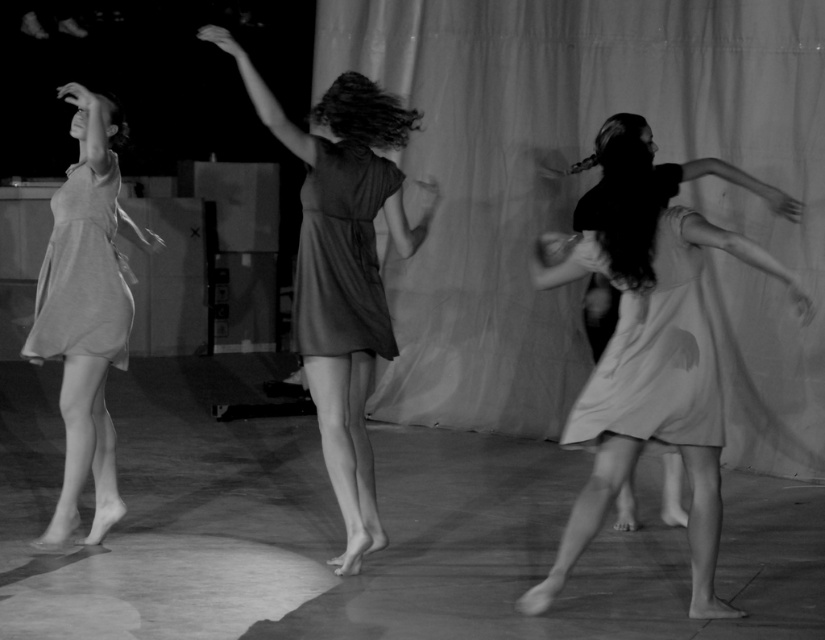
Question: Where is matte white dress at right located in relation to satin dress at center in the image?

Choices:
 (A) above
 (B) below

Answer: (B)

Question: Which point appears farthest from the camera in this image?

Choices:
 (A) (349, 244)
 (B) (310, 314)
 (C) (72, 289)
 (D) (92, 212)

Answer: (D)

Question: Can you confirm if matte gray dress at left is positioned below light gray cotton dress at left?

Choices:
 (A) no
 (B) yes

Answer: (B)

Question: Which point is farther to the camera?

Choices:
 (A) (668, 234)
 (B) (78, 225)
 (C) (262, 93)

Answer: (B)

Question: Is matte dark dress at center positioned before light gray cotton dress at left?

Choices:
 (A) yes
 (B) no

Answer: (A)

Question: Among these points, which one is farthest from the camera?

Choices:
 (A) (561, 541)
 (B) (69, 467)

Answer: (B)